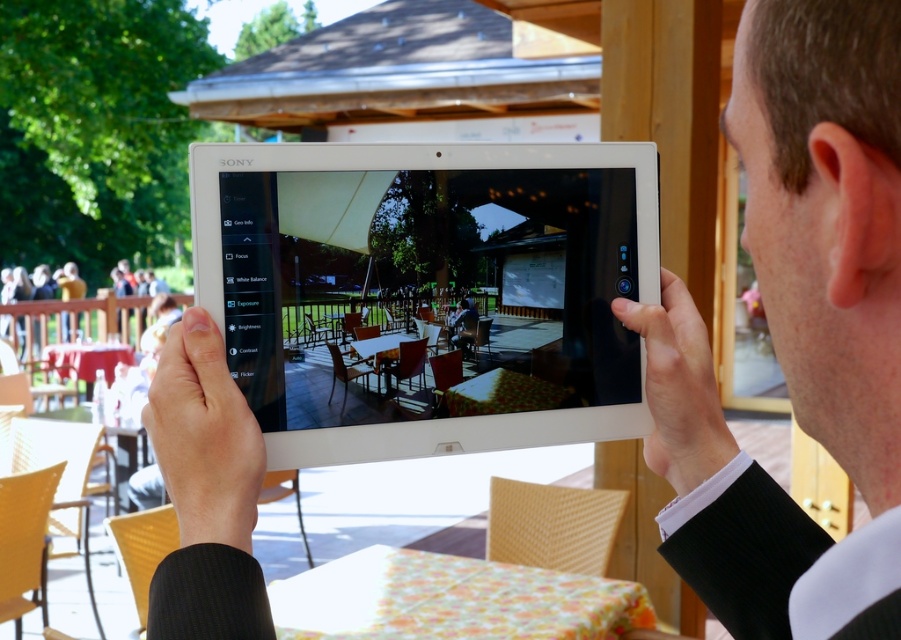
You are standing in the outdoor cafe scene shown on the Sony tablet. You want to take a photo of the wooden structure with a slanted roof using your phone camera. The tablet shows the live viewfinder with a point at coordinates (366, 316). If your phone camera is 28.45 inches away from this point, will you be able to capture the entire wooden structure in your photo?

The point at coordinates (366, 316) is 28.45 inches away from your phone camera. Since the wooden structure with a slanted roof is within this distance, you can capture it entirely in your photo.

You are a photographer trying to capture a clear image of the outdoor cafe scene displayed on the white glossy tablet at center. However, you notice that the smooth skin hand at center is partially obscuring the tablet. Based on their sizes, can you determine if moving the hand slightly upwards would allow the entire tablet to be visible without obstruction?

The white glossy tablet at center has a greater height compared to the smooth skin hand at center. Moving the hand slightly upwards would allow the entire tablet to be visible without obstruction since the tablet is taller than the hand.